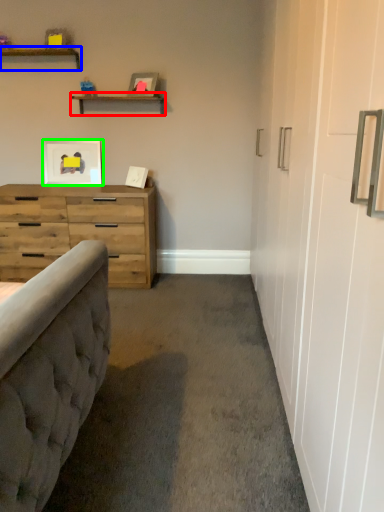
Question: Considering the real-world distances, which object is closest to shelf (highlighted by a red box)? shelf (highlighted by a blue box) or picture frame (highlighted by a green box).

Choices:
 (A) shelf
 (B) picture frame

Answer: (A)